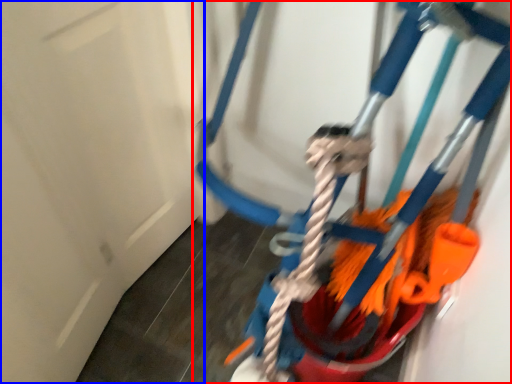
Question: Which of the following is the closest to the observer, toy (highlighted by a red box) or door (highlighted by a blue box)?

Choices:
 (A) toy
 (B) door

Answer: (B)